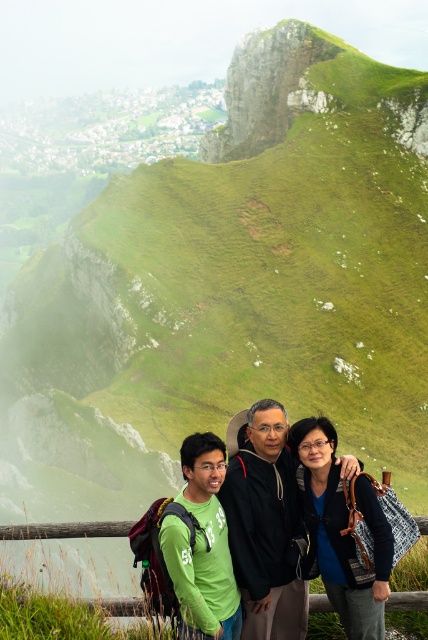
Which is more to the left, matte black jacket at center or green matte shirt at lower left?

green matte shirt at lower left

Does matte black jacket at center appear over green matte shirt at lower left?

Correct, matte black jacket at center is located above green matte shirt at lower left.

Describe the element at coordinates (339, 531) in the screenshot. This screenshot has width=428, height=640. I see `matte black jacket at center` at that location.

This screenshot has width=428, height=640. Find the location of `matte black jacket at center`. matte black jacket at center is located at coordinates (339, 531).

In the scene shown: Who is shorter, green matte shirt at lower center or green matte shirt at lower left?

With less height is green matte shirt at lower left.

Can you confirm if green matte shirt at lower center is taller than green matte shirt at lower left?

Correct, green matte shirt at lower center is much taller as green matte shirt at lower left.

At what (x,y) coordinates should I click in order to perform the action: click on green matte shirt at lower center. Please return your answer as a coordinate pair (x, y). This screenshot has height=640, width=428. Looking at the image, I should click on (264, 522).

Identify the location of green matte shirt at lower center. (264, 522).

Can you confirm if green matte shirt at lower center is smaller than matte black jacket at center?

Incorrect, green matte shirt at lower center is not smaller in size than matte black jacket at center.

Is green matte shirt at lower center further to camera compared to matte black jacket at center?

No, green matte shirt at lower center is in front of matte black jacket at center.

Is point (234, 545) positioned before point (359, 618)?

No.

Locate an element on the screen. The height and width of the screenshot is (640, 428). green matte shirt at lower center is located at coordinates (264, 522).